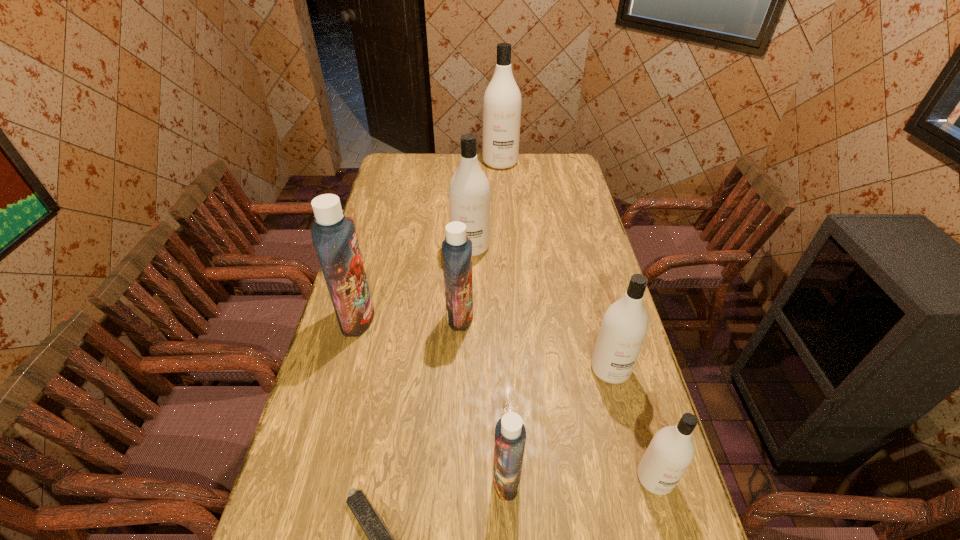
The height and width of the screenshot is (540, 960). Find the location of `empty space that is in between the farthest white shampoo and the third farthest white shampoo`. empty space that is in between the farthest white shampoo and the third farthest white shampoo is located at coordinates (556, 266).

Image resolution: width=960 pixels, height=540 pixels. I want to click on free space between the smallest white shampoo and the smallest blue shampoo, so click(x=581, y=479).

Locate an element on the screen. The image size is (960, 540). vacant area that lies between the third nearest white shampoo and the nearest white shampoo is located at coordinates (563, 362).

Identify which object is the nearest to the smallest white shampoo. Please provide its 2D coordinates. Your answer should be formatted as a tuple, i.e. [(x, y)], where the tuple contains the x and y coordinates of a point satisfying the conditions above.

[(624, 326)]

Locate which object ranks fifth in proximity to the second smallest blue shampoo. Please provide its 2D coordinates. Your answer should be formatted as a tuple, i.e. [(x, y)], where the tuple contains the x and y coordinates of a point satisfying the conditions above.

[(380, 539)]

You are a GUI agent. You are given a task and a screenshot of the screen. Output one action in this format:
    pyautogui.click(x=<x>, y=<y>)
    Task: Click on the sixth closest shampoo to the rightmost blue shampoo
    Image resolution: width=960 pixels, height=540 pixels.
    Given the screenshot: What is the action you would take?
    click(502, 101)

Identify which shampoo is located as the sixth nearest to the smallest white shampoo. Please provide its 2D coordinates. Your answer should be formatted as a tuple, i.e. [(x, y)], where the tuple contains the x and y coordinates of a point satisfying the conditions above.

[(502, 101)]

Identify which white shampoo is the fourth nearest to the second smallest blue shampoo. Please provide its 2D coordinates. Your answer should be formatted as a tuple, i.e. [(x, y)], where the tuple contains the x and y coordinates of a point satisfying the conditions above.

[(502, 101)]

The image size is (960, 540). In order to click on the third closest white shampoo to the nearest white shampoo in this screenshot , I will do `click(502, 101)`.

The height and width of the screenshot is (540, 960). I want to click on blue shampoo that is the second closest to the farthest object, so click(334, 236).